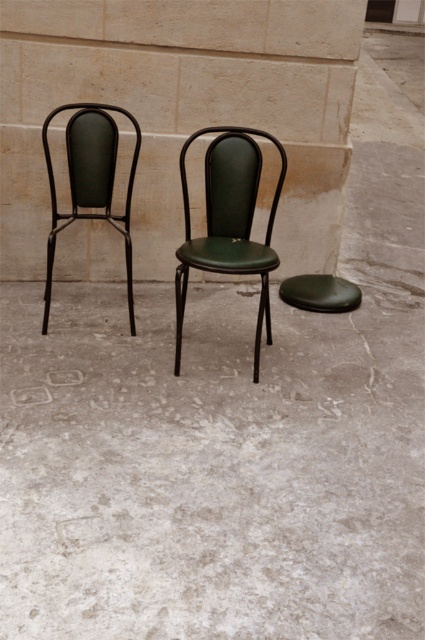
Which is behind, point (187, 260) or point (68, 212)?

The point (68, 212) is more distant.

Is green leather chair at center taller than green matte chair at left?

Correct, green leather chair at center is much taller as green matte chair at left.

Who is more forward, (212, 264) or (107, 173)?

Point (212, 264) is more forward.

Identify the location of green leather chair at center. (229, 221).

Is green matte chair at left closer to the viewer compared to green leather stool at center?

Yes, it is.

This screenshot has width=425, height=640. Describe the element at coordinates (90, 180) in the screenshot. I see `green matte chair at left` at that location.

You are a GUI agent. You are given a task and a screenshot of the screen. Output one action in this format:
    pyautogui.click(x=<x>, y=<y>)
    Task: Click on the green matte chair at left
    This screenshot has height=640, width=425.
    Given the screenshot: What is the action you would take?
    pyautogui.click(x=90, y=180)

Does green leather chair at center have a greater height compared to green leather stool at center?

Yes.

Between green leather chair at center and green leather stool at center, which one has less height?

green leather stool at center is shorter.

Is point (246, 253) positioned before point (323, 289)?

Yes, point (246, 253) is closer to viewer.

Identify the location of green leather chair at center. This screenshot has height=640, width=425. (229, 221).